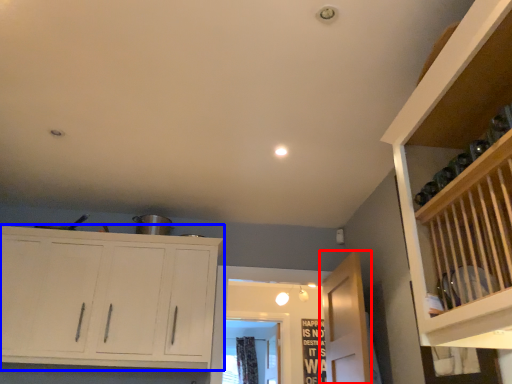
Question: Which object is further to the camera taking this photo, door (highlighted by a red box) or cupboard (highlighted by a blue box)?

Choices:
 (A) door
 (B) cupboard

Answer: (B)